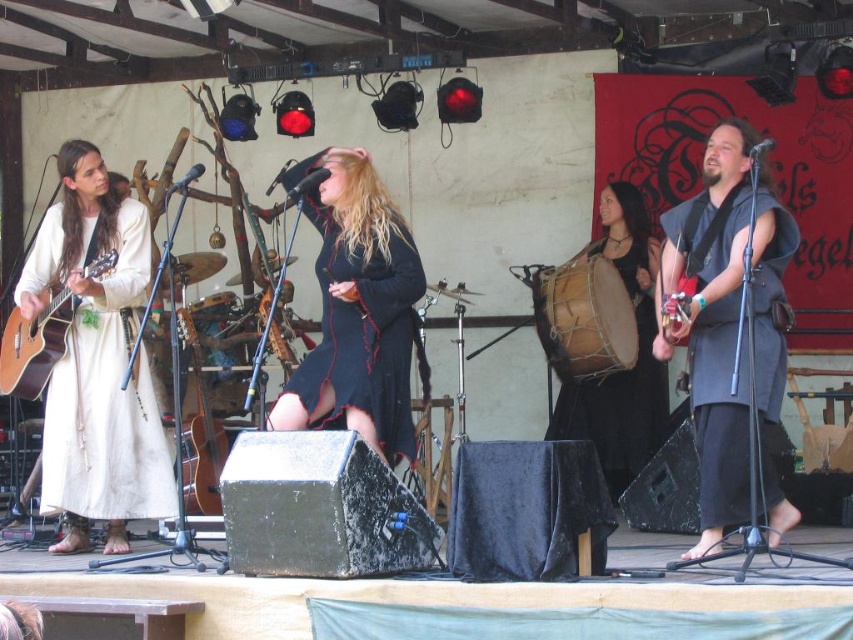
You are standing at the center of the stage where the singer is performing. There are two points marked on the stage floor. The first point is at coordinates point (572, 376) and the second point is at point (42, 310). If you look towards the audience, which point is closer to you?

Point (42, 310) is closer to you because it is in front of point (572, 376), which is behind it.

You are a stagehand who needs to place a new spotlight exactly at the center of the stage. The stage is a rectangle with coordinates from 0 to 1 on both axes. You see the leather drum at center. Where should you place the spotlight to ensure it is centered?

The center of the stage is at coordinates (426, 320). The leather drum at center is located at (584, 317), so the spotlight should be placed at (426, 320) to be centered.